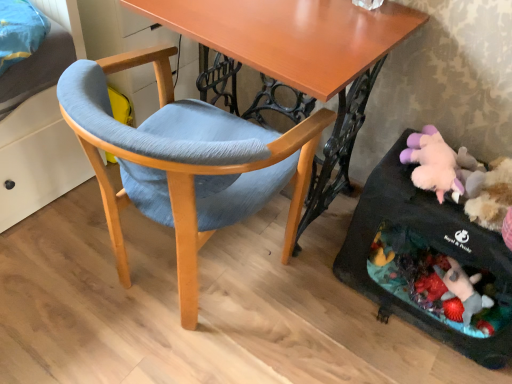
Locate an element on the screen. The image size is (512, 384). vacant space positioned to the left of black fabric baby carriage at lower right is located at coordinates (316, 311).